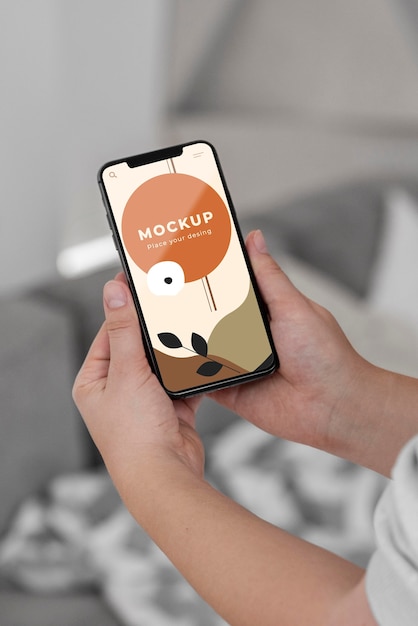
Identify the location of phone. Image resolution: width=418 pixels, height=626 pixels. coord(235,326).